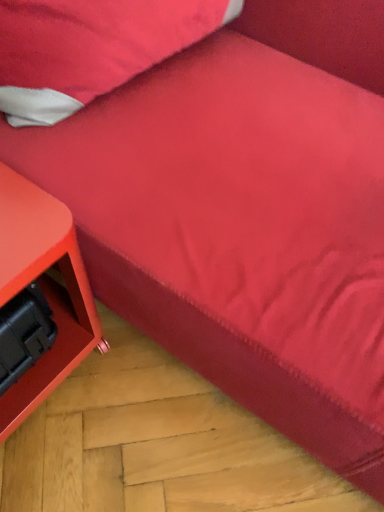
Question: Could you tell me if matte orange side table at lower left is facing velvety red pillow at upper left?

Choices:
 (A) yes
 (B) no

Answer: (B)

Question: Can you confirm if matte orange side table at lower left is thinner than velvety red pillow at upper left?

Choices:
 (A) yes
 (B) no

Answer: (B)

Question: From a real-world perspective, is matte orange side table at lower left positioned over velvety red pillow at upper left based on gravity?

Choices:
 (A) yes
 (B) no

Answer: (B)

Question: From the image's perspective, does matte orange side table at lower left appear higher than velvety red pillow at upper left?

Choices:
 (A) no
 (B) yes

Answer: (A)

Question: Is matte orange side table at lower left looking in the opposite direction of velvety red pillow at upper left?

Choices:
 (A) yes
 (B) no

Answer: (B)

Question: Can you confirm if matte orange side table at lower left is smaller than velvety red pillow at upper left?

Choices:
 (A) yes
 (B) no

Answer: (A)

Question: From the image's perspective, does velvety red pillow at upper left appear higher than matte orange side table at lower left?

Choices:
 (A) yes
 (B) no

Answer: (A)

Question: Is velvety red pillow at upper left next to matte orange side table at lower left and touching it?

Choices:
 (A) no
 (B) yes

Answer: (A)

Question: Is velvety red pillow at upper left positioned in front of matte orange side table at lower left?

Choices:
 (A) yes
 (B) no

Answer: (B)

Question: Is velvety red pillow at upper left taller than matte orange side table at lower left?

Choices:
 (A) no
 (B) yes

Answer: (A)

Question: Does velvety red pillow at upper left appear on the right side of matte orange side table at lower left?

Choices:
 (A) no
 (B) yes

Answer: (B)

Question: Is velvety red pillow at upper left wider than matte orange side table at lower left?

Choices:
 (A) no
 (B) yes

Answer: (A)

Question: In terms of height, does velvety red pillow at upper left look taller or shorter compared to matte orange side table at lower left?

Choices:
 (A) tall
 (B) short

Answer: (B)